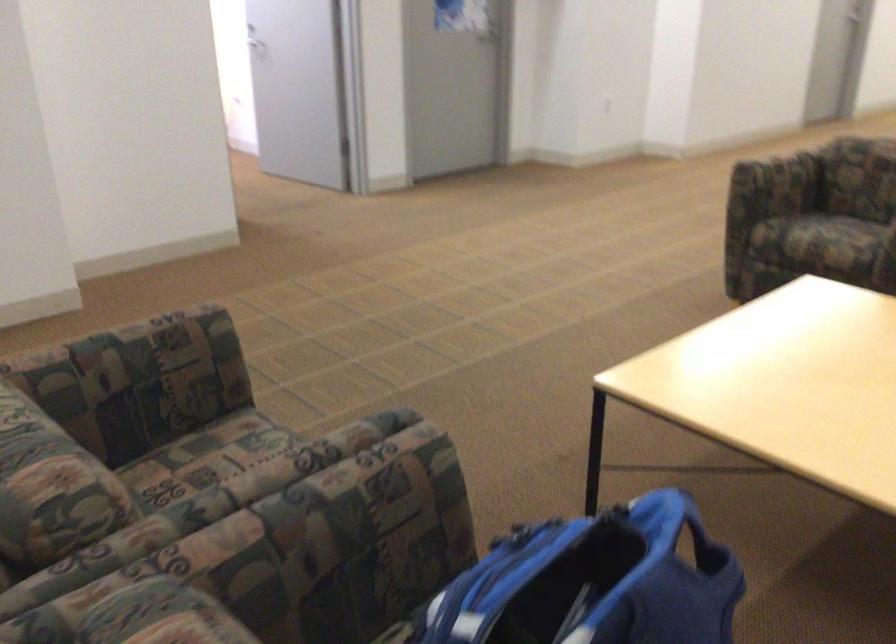
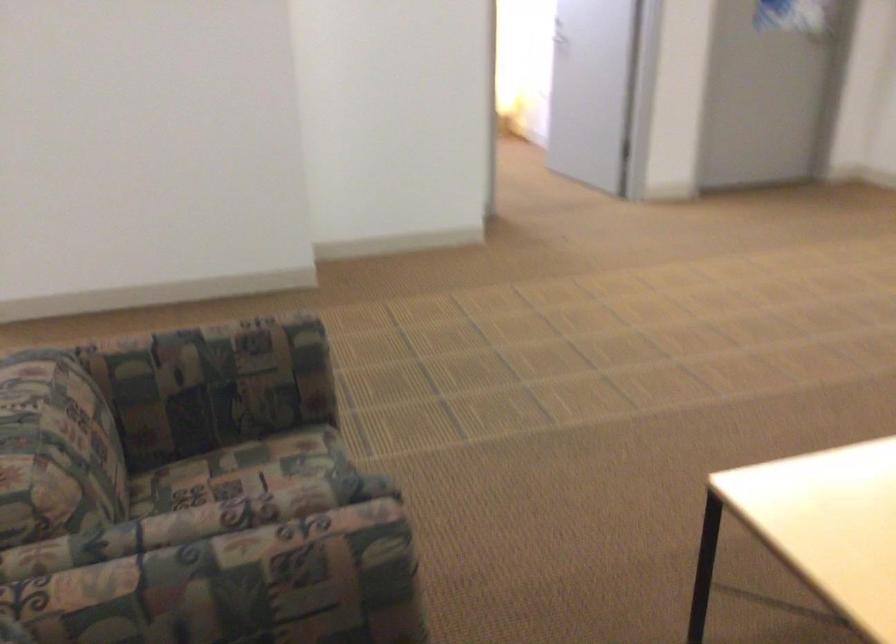
Where in the second image is the point corresponding to point (141, 351) from the first image?

(218, 351)